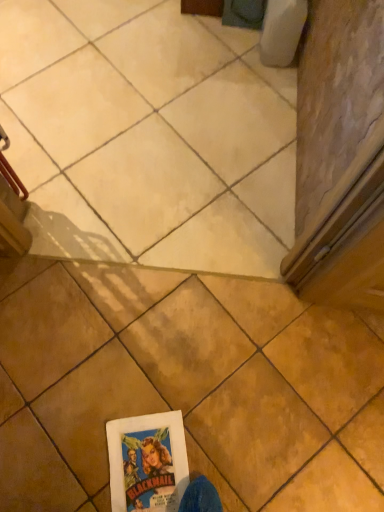
Image resolution: width=384 pixels, height=512 pixels. I want to click on free location above matte beige tile at center, the 1th tile when ordered from back to front (from a real-world perspective), so click(x=143, y=108).